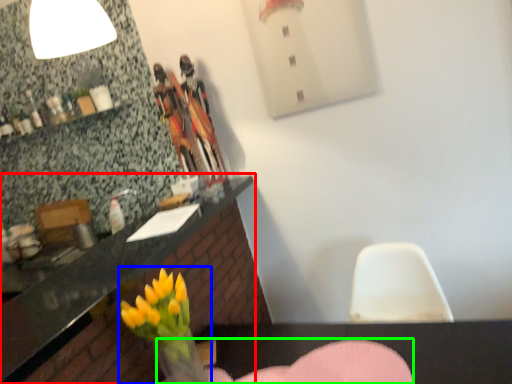
Question: Which is nearer to the countertop (highlighted by a red box)? floral arrangement (highlighted by a blue box) or armchair (highlighted by a green box).

Choices:
 (A) floral arrangement
 (B) armchair

Answer: (A)